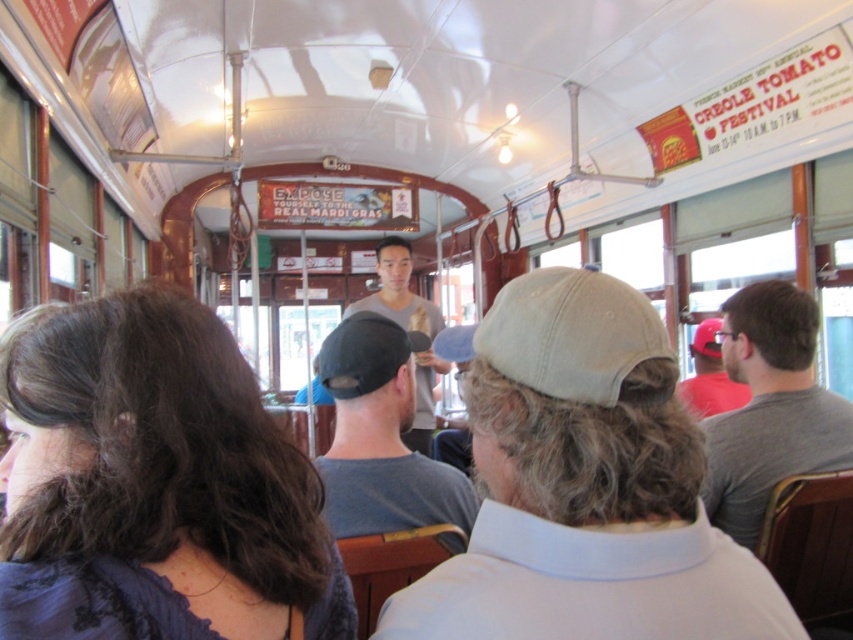
Question: Among these objects, which one is farthest from the camera?

Choices:
 (A) black fabric baseball cap at center
 (B) gray matte shirt at right

Answer: (B)

Question: Does light beige cap at center appear under beige fabric baseball cap at center?

Choices:
 (A) yes
 (B) no

Answer: (A)

Question: Which object is positioned farthest from the dark brown hair at center?

Choices:
 (A) dark gray cotton cap at center
 (B) light beige cap at center
 (C) gray matte shirt at right
 (D) beige fabric baseball cap at center

Answer: (D)

Question: Among these points, which one is nearest to the camera?

Choices:
 (A) (505, 332)
 (B) (386, 326)
 (C) (665, 512)

Answer: (C)

Question: Does beige fabric baseball cap at center appear under black fabric baseball cap at center?

Choices:
 (A) yes
 (B) no

Answer: (A)

Question: Does beige fabric baseball cap at center have a smaller size compared to black fabric baseball cap at center?

Choices:
 (A) no
 (B) yes

Answer: (B)